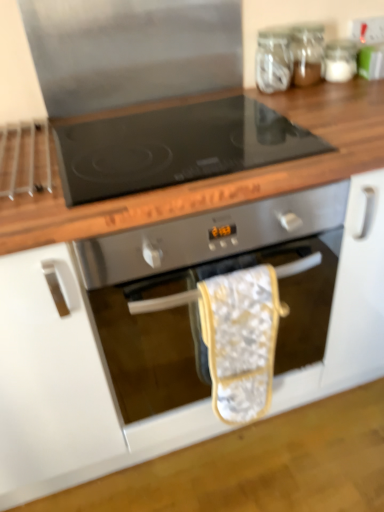
The width and height of the screenshot is (384, 512). Identify the location of unoccupied region to the right of transparent glass jar at upper right, placed as the 2th glass jar when sorted from left to right. (357, 84).